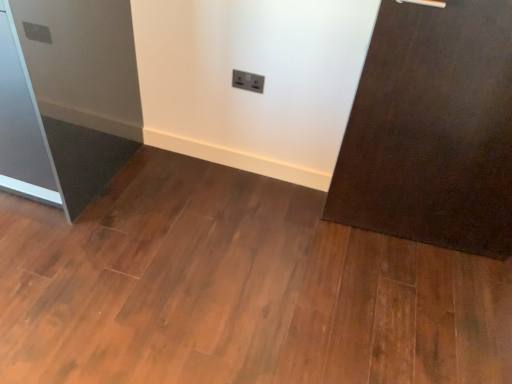
Question: Can we say satin silver fridge at left lies outside white plastic electric outlet at center?

Choices:
 (A) no
 (B) yes

Answer: (B)

Question: Is satin silver fridge at left positioned with its back to white plastic electric outlet at center?

Choices:
 (A) no
 (B) yes

Answer: (A)

Question: Could you tell me if satin silver fridge at left is turned towards white plastic electric outlet at center?

Choices:
 (A) no
 (B) yes

Answer: (A)

Question: Is the position of satin silver fridge at left less distant than that of white plastic electric outlet at center?

Choices:
 (A) no
 (B) yes

Answer: (B)

Question: Does satin silver fridge at left appear on the right side of white plastic electric outlet at center?

Choices:
 (A) yes
 (B) no

Answer: (B)

Question: Is satin silver fridge at left beside white plastic electric outlet at center?

Choices:
 (A) no
 (B) yes

Answer: (A)

Question: Is white plastic electric outlet at center shorter than satin silver fridge at left?

Choices:
 (A) no
 (B) yes

Answer: (B)

Question: Can you confirm if white plastic electric outlet at center is bigger than satin silver fridge at left?

Choices:
 (A) yes
 (B) no

Answer: (B)

Question: From a real-world perspective, is white plastic electric outlet at center located beneath satin silver fridge at left?

Choices:
 (A) yes
 (B) no

Answer: (B)

Question: Does white plastic electric outlet at center have a smaller size compared to satin silver fridge at left?

Choices:
 (A) no
 (B) yes

Answer: (B)

Question: Could you tell me if white plastic electric outlet at center is turned towards satin silver fridge at left?

Choices:
 (A) yes
 (B) no

Answer: (B)

Question: Is white plastic electric outlet at center positioned with its back to satin silver fridge at left?

Choices:
 (A) yes
 (B) no

Answer: (B)

Question: In terms of height, does satin silver fridge at left look taller or shorter compared to white plastic electric outlet at center?

Choices:
 (A) tall
 (B) short

Answer: (A)